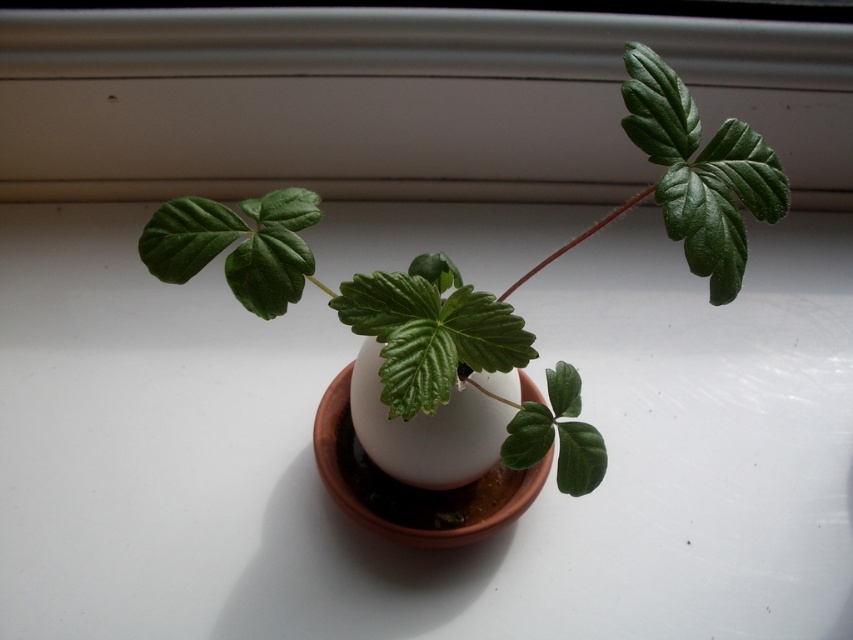
Question: Which point is closer to the camera taking this photo?

Choices:
 (A) (450, 492)
 (B) (39, 90)
 (C) (433, 314)

Answer: (C)

Question: Can you confirm if white matte window sill at upper center is positioned below green matte plant at center?

Choices:
 (A) no
 (B) yes

Answer: (A)

Question: Does green matte plant at center have a greater width compared to terracotta clay pot at center?

Choices:
 (A) yes
 (B) no

Answer: (A)

Question: Is green matte plant at center further to camera compared to terracotta clay pot at center?

Choices:
 (A) yes
 (B) no

Answer: (B)

Question: Which is nearer to the white matte window sill at upper center?

Choices:
 (A) terracotta clay pot at center
 (B) green matte plant at center

Answer: (A)

Question: Which of the following is the farthest from the observer?

Choices:
 (A) (592, 429)
 (B) (621, 20)
 (C) (328, 460)

Answer: (B)